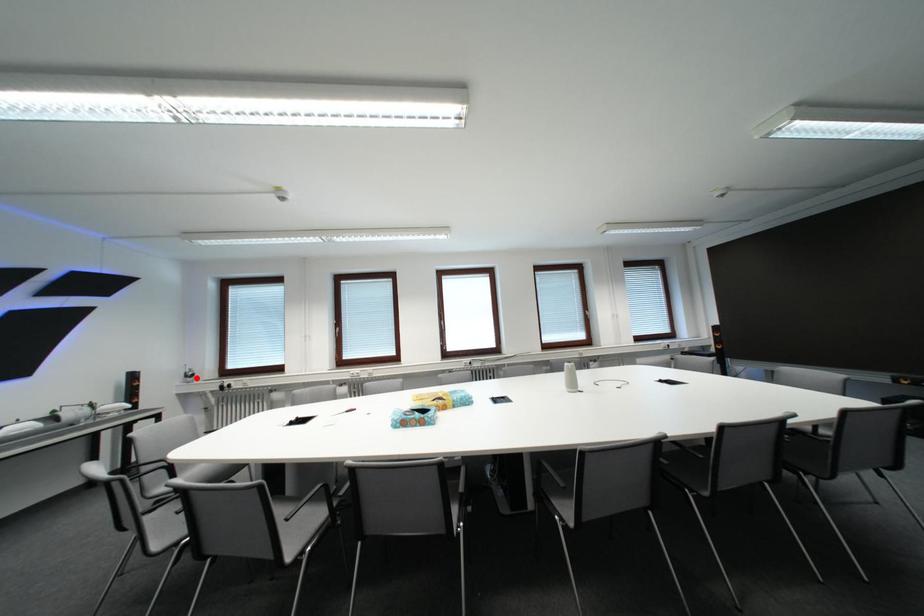
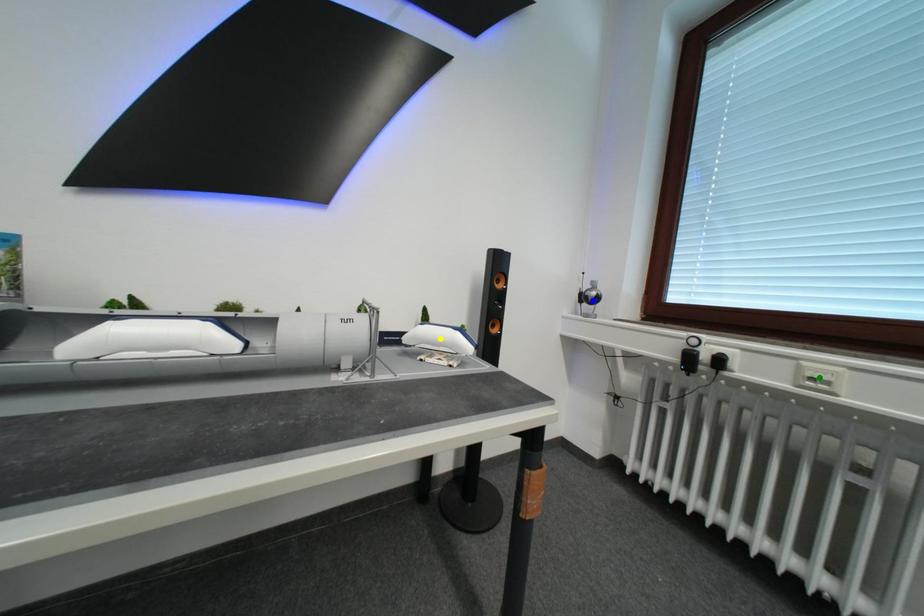
Question: I am providing you with two images of the same scene from different viewpoints. A red point is marked on the first image. You are given multiple points on the second image. Can you choose the point in image 2 that corresponds to the point in image 1?

Choices:
 (A) yellow point
 (B) green point
 (C) blue point

Answer: (C)